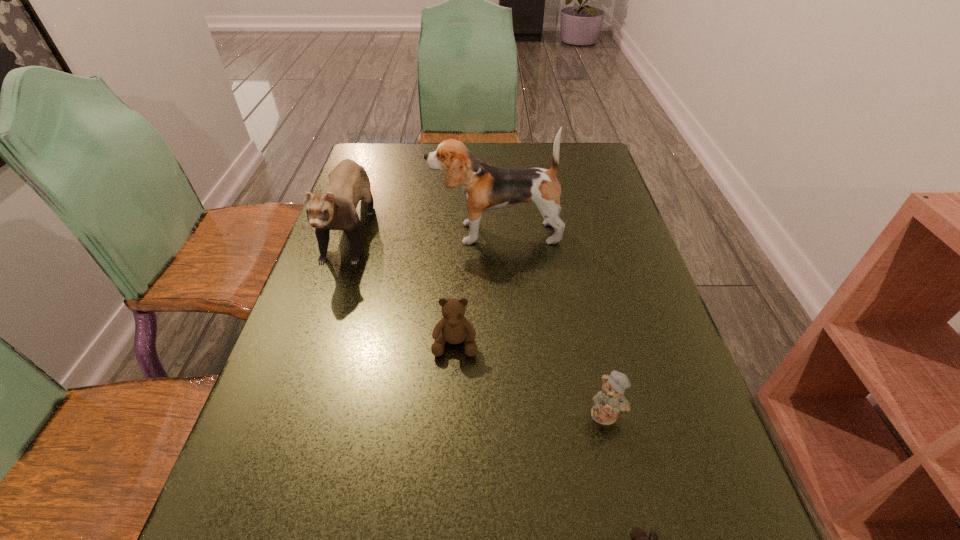
Where is `puppy`? The width and height of the screenshot is (960, 540). puppy is located at coordinates (484, 187).

At what (x,y) coordinates should I click in order to perform the action: click on the second tallest object. Please return your answer as a coordinate pair (x, y). The height and width of the screenshot is (540, 960). Looking at the image, I should click on (348, 182).

Find the location of a particular element. Image resolution: width=960 pixels, height=540 pixels. the leftmost object is located at coordinates (348, 182).

This screenshot has height=540, width=960. Find the location of `the third nearest object`. the third nearest object is located at coordinates (454, 328).

This screenshot has width=960, height=540. I want to click on the farthest teddy bear, so click(454, 328).

At what (x,y) coordinates should I click in order to perform the action: click on the second nearest object. Please return your answer as a coordinate pair (x, y). The height and width of the screenshot is (540, 960). Looking at the image, I should click on (610, 401).

At what (x,y) coordinates should I click in order to perform the action: click on vacant space positioned at the face of the tallest object. Please return your answer as a coordinate pair (x, y). The height and width of the screenshot is (540, 960). Looking at the image, I should click on (354, 233).

This screenshot has height=540, width=960. In order to click on vacant space located 0.070m at the face of the tallest object in this screenshot , I will do `click(404, 233)`.

This screenshot has height=540, width=960. In order to click on vacant space positioned 0.270m at the face of the tallest object in this screenshot , I will do `click(328, 233)`.

The width and height of the screenshot is (960, 540). Identify the location of free location located 0.320m on the face of the leftmost object. pyautogui.click(x=289, y=407).